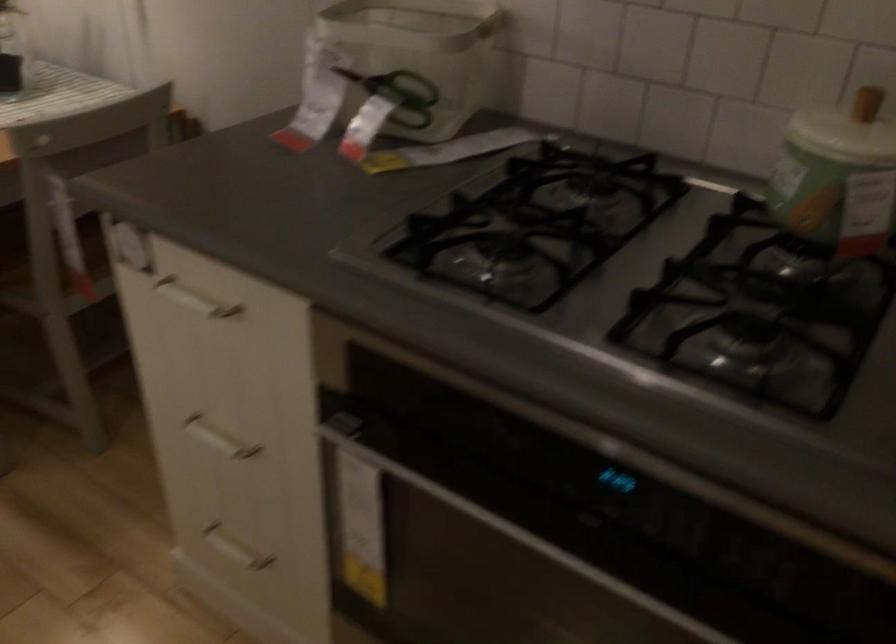
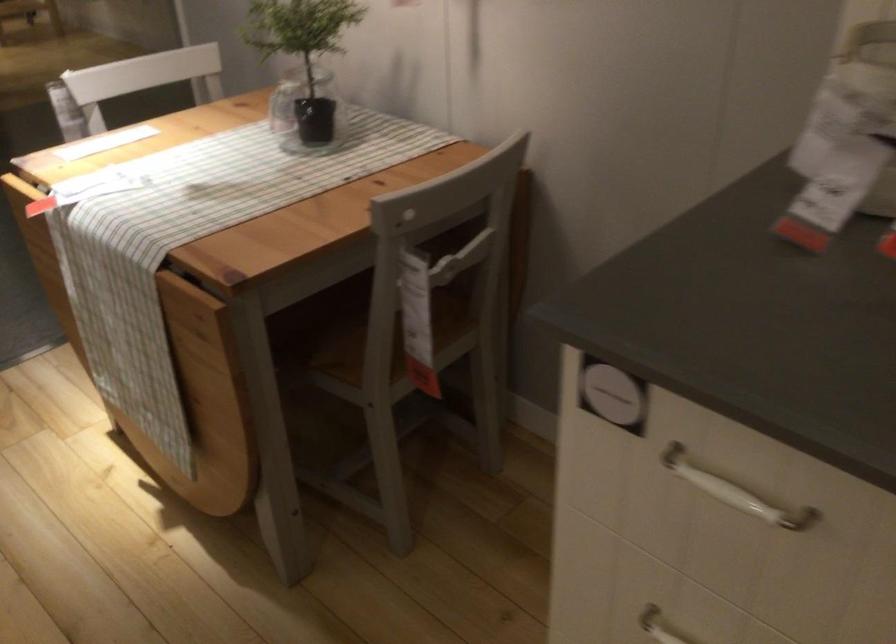
Question: Based on the continuous images, in which direction is the camera rotating? Reply with the corresponding letter.

Choices:
 (A) Left
 (B) Right
 (C) Up
 (D) Down

Answer: (A)